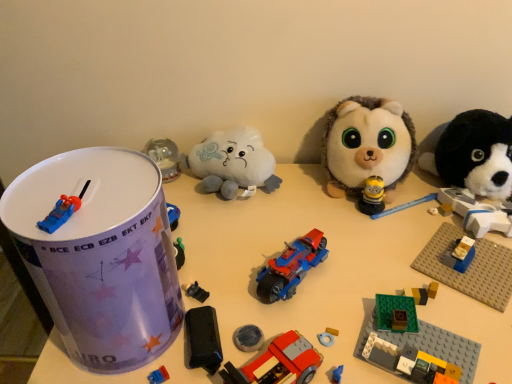
The image size is (512, 384). I want to click on free space in front of fluffy white plush at center, the 8th toy when ordered from left to right, so click(394, 251).